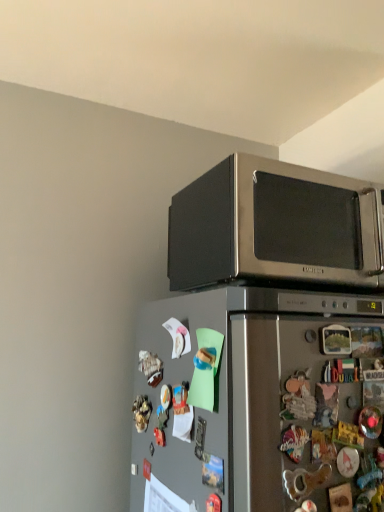
What do you see at coordinates (259, 402) in the screenshot? This screenshot has height=512, width=384. I see `satin silver refrigerator at lower left` at bounding box center [259, 402].

In order to face satin silver refrigerator at lower left, should I rotate leftwards or rightwards?

Turn right by 11.210 degrees to look at satin silver refrigerator at lower left.

Find the location of a particular element. The width and height of the screenshot is (384, 512). satin silver refrigerator at lower left is located at coordinates (259, 402).

Locate an element on the screen. stainless steel microwave at upper right is located at coordinates (275, 226).

What do you see at coordinates (275, 226) in the screenshot? I see `stainless steel microwave at upper right` at bounding box center [275, 226].

In order to face stainless steel microwave at upper right, should I rotate leftwards or rightwards?

Turn right by 11.136 degrees to look at stainless steel microwave at upper right.

This screenshot has width=384, height=512. What are the coordinates of `satin silver refrigerator at lower left` in the screenshot? It's located at (259, 402).

Is stainless steel microwave at upper right at the left side of satin silver refrigerator at lower left?

In fact, stainless steel microwave at upper right is to the right of satin silver refrigerator at lower left.

Does stainless steel microwave at upper right lie in front of satin silver refrigerator at lower left?

No, stainless steel microwave at upper right is further to the viewer.

Considering the points (285, 232) and (292, 487), which point is behind, point (285, 232) or point (292, 487)?

Point (285, 232)

From the image's perspective, which one is positioned higher, stainless steel microwave at upper right or satin silver refrigerator at lower left?

stainless steel microwave at upper right.

From a real-world perspective, relative to satin silver refrigerator at lower left, is stainless steel microwave at upper right vertically above or below?

stainless steel microwave at upper right is situated higher than satin silver refrigerator at lower left in the real world.

From the picture: Considering the relative sizes of stainless steel microwave at upper right and satin silver refrigerator at lower left in the image provided, is stainless steel microwave at upper right wider than satin silver refrigerator at lower left?

Incorrect, the width of stainless steel microwave at upper right does not surpass that of satin silver refrigerator at lower left.

Considering the sizes of objects stainless steel microwave at upper right and satin silver refrigerator at lower left in the image provided, who is shorter, stainless steel microwave at upper right or satin silver refrigerator at lower left?

Standing shorter between the two is stainless steel microwave at upper right.

Who is smaller, stainless steel microwave at upper right or satin silver refrigerator at lower left?

With smaller size is stainless steel microwave at upper right.

Is stainless steel microwave at upper right surrounding satin silver refrigerator at lower left?

That's incorrect, satin silver refrigerator at lower left is not inside stainless steel microwave at upper right.

Is stainless steel microwave at upper right placed right next to satin silver refrigerator at lower left?

stainless steel microwave at upper right is not next to satin silver refrigerator at lower left, and they're not touching.

Is stainless steel microwave at upper right turned away from satin silver refrigerator at lower left?

No, stainless steel microwave at upper right is not facing away from satin silver refrigerator at lower left.

What's the angular difference between stainless steel microwave at upper right and satin silver refrigerator at lower left's facing directions?

The facing directions of stainless steel microwave at upper right and satin silver refrigerator at lower left are 0.000289 degrees apart.

Identify the location of microwave oven that appears behind the satin silver refrigerator at lower left. (275, 226).

Which object is positioned more to the left, satin silver refrigerator at lower left or stainless steel microwave at upper right?

satin silver refrigerator at lower left.

Who is more distant, satin silver refrigerator at lower left or stainless steel microwave at upper right?

stainless steel microwave at upper right is behind.

Does point (357, 384) come farther from viewer compared to point (298, 193)?

No, (357, 384) is in front of (298, 193).

From the image's perspective, which object appears higher, satin silver refrigerator at lower left or stainless steel microwave at upper right?

From the image's view, stainless steel microwave at upper right is above.

From a real-world perspective, is satin silver refrigerator at lower left positioned under stainless steel microwave at upper right based on gravity?

Correct, in the physical world, satin silver refrigerator at lower left is lower than stainless steel microwave at upper right.

Can you confirm if satin silver refrigerator at lower left is thinner than stainless steel microwave at upper right?

No, satin silver refrigerator at lower left is not thinner than stainless steel microwave at upper right.

Which of these two, satin silver refrigerator at lower left or stainless steel microwave at upper right, stands taller?

satin silver refrigerator at lower left.

Considering the sizes of satin silver refrigerator at lower left and stainless steel microwave at upper right in the image, is satin silver refrigerator at lower left bigger or smaller than stainless steel microwave at upper right?

Clearly, satin silver refrigerator at lower left is larger in size than stainless steel microwave at upper right.

Is stainless steel microwave at upper right located within satin silver refrigerator at lower left?

No, stainless steel microwave at upper right is not inside satin silver refrigerator at lower left.

In the scene shown: Is satin silver refrigerator at lower left not close to stainless steel microwave at upper right?

No, satin silver refrigerator at lower left is not far away from stainless steel microwave at upper right.

Is satin silver refrigerator at lower left facing towards stainless steel microwave at upper right?

No, satin silver refrigerator at lower left is not oriented towards stainless steel microwave at upper right.

Can you tell me how much satin silver refrigerator at lower left and stainless steel microwave at upper right differ in facing direction?

The angle between the facing direction of satin silver refrigerator at lower left and the facing direction of stainless steel microwave at upper right is 0.000289 degrees.

Identify the location of microwave oven above the satin silver refrigerator at lower left (from the image's perspective). The width and height of the screenshot is (384, 512). (275, 226).

You are a GUI agent. You are given a task and a screenshot of the screen. Output one action in this format:
    pyautogui.click(x=<x>, y=<y>)
    Task: Click on the refrigerator in front of the stainless steel microwave at upper right
    
    Given the screenshot: What is the action you would take?
    pyautogui.click(x=259, y=402)

Identify the location of microwave oven located above the satin silver refrigerator at lower left (from the image's perspective). The height and width of the screenshot is (512, 384). (275, 226).